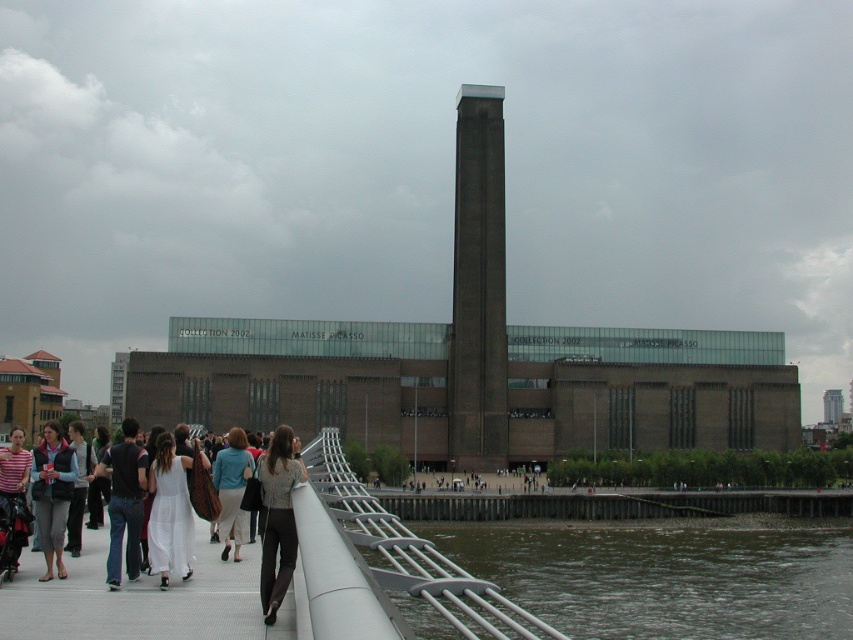
Based on the photo, you are standing on the pedestrian bridge and see the dark brown water at lower center and the matte black vest at lower left. Which object is closer to your right side?

The dark brown water at lower center is to the right of the matte black vest at lower left, so it is closer to your right side.

Looking at this image, you are a photographer standing at the Tate Modern museum entrance. You see a person wearing dark blue jeans at left and a striped cotton shirt at lower left. Which clothing item is wider?

The dark blue jeans at left is wider than the striped cotton shirt at lower left.

You are standing at the Tate Modern museum and want to take a photo of the metallic gray railing at lower center. If your camera can focus up to 100 feet, will you be able to capture a clear image of the railing?

The metallic gray railing at lower center is 85.67 feet away from the camera, which is within the camera focus range of 100 feet. Therefore, you can capture a clear image of the metallic gray railing at lower center.